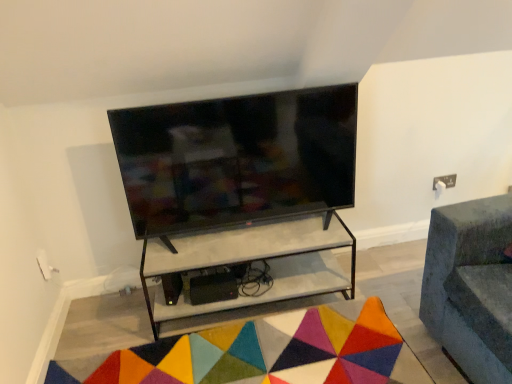
You are a GUI agent. You are given a task and a screenshot of the screen. Output one action in this format:
    pyautogui.click(x=<x>, y=<y>)
    Task: Click on the vacant space underneath matte black tv at center (from a real-world perspective)
    The image size is (512, 384).
    Given the screenshot: What is the action you would take?
    pyautogui.click(x=230, y=230)